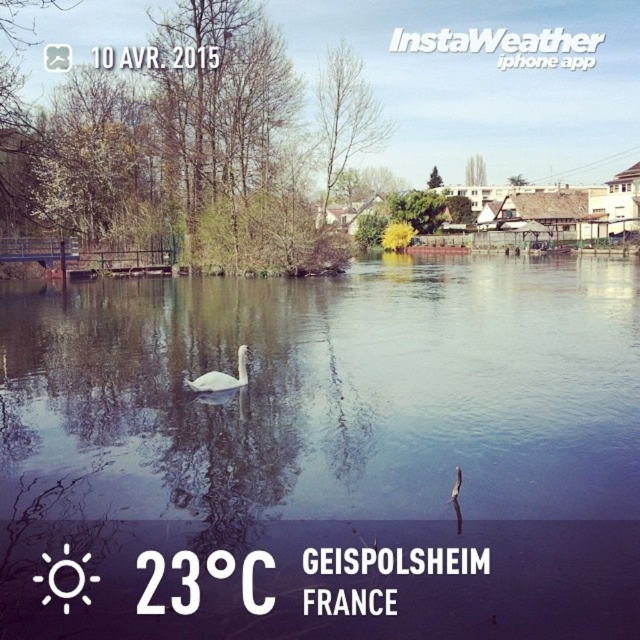
Between clear water at center and white glossy swan at center, which one has more height?

Standing taller between the two is clear water at center.

Between point (161, 413) and point (221, 385), which one is positioned behind?

The point (221, 385) is behind.

Does point (67, 444) come farther from viewer compared to point (200, 381)?

No, it is not.

Identify the location of clear water at center. (326, 452).